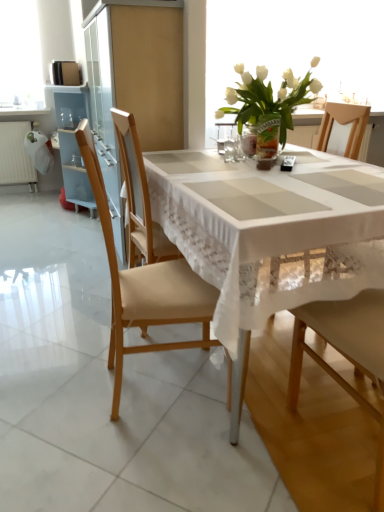
Question: Is white glass vase at upper center behind light brown wood chair at left, the first chair when ordered from left to right?

Choices:
 (A) no
 (B) yes

Answer: (B)

Question: Is white glass vase at upper center not close to light brown wood chair at left, the first chair when ordered from left to right?

Choices:
 (A) no
 (B) yes

Answer: (B)

Question: Does white glass vase at upper center come in front of light brown wood chair at left, acting as the 2th chair starting from the right?

Choices:
 (A) no
 (B) yes

Answer: (A)

Question: From the image's perspective, would you say white glass vase at upper center is shown under light brown wood chair at left, acting as the 2th chair starting from the right?

Choices:
 (A) yes
 (B) no

Answer: (B)

Question: From the image's perspective, is white glass vase at upper center located above light brown wood chair at left, acting as the 2th chair starting from the right?

Choices:
 (A) yes
 (B) no

Answer: (A)

Question: Choose the correct answer: Is white glass vase at upper center inside white lace tablecloth at center or outside it?

Choices:
 (A) outside
 (B) inside

Answer: (A)

Question: From a real-world perspective, is white glass vase at upper center physically located above or below white lace tablecloth at center?

Choices:
 (A) above
 (B) below

Answer: (A)

Question: Is white glass vase at upper center in front of or behind white lace tablecloth at center in the image?

Choices:
 (A) behind
 (B) front

Answer: (A)

Question: In terms of size, does white glass vase at upper center appear bigger or smaller than white lace tablecloth at center?

Choices:
 (A) small
 (B) big

Answer: (A)

Question: From the image's perspective, is translucent glass vase at center above or below white lace tablecloth at center?

Choices:
 (A) below
 (B) above

Answer: (B)

Question: Considering the positions of translucent glass vase at center and white lace tablecloth at center in the image, is translucent glass vase at center taller or shorter than white lace tablecloth at center?

Choices:
 (A) tall
 (B) short

Answer: (B)

Question: Considering the positions of point (261, 131) and point (215, 216), is point (261, 131) closer or farther from the camera than point (215, 216)?

Choices:
 (A) farther
 (B) closer

Answer: (A)

Question: Is translucent glass vase at center wider or thinner than white lace tablecloth at center?

Choices:
 (A) wide
 (B) thin

Answer: (B)

Question: Is light brown wood chair at left, acting as the 2th chair starting from the right, to the left or to the right of translucent glass vase at center in the image?

Choices:
 (A) right
 (B) left

Answer: (B)

Question: Considering their positions, is light brown wood chair at left, acting as the 2th chair starting from the right, located in front of or behind translucent glass vase at center?

Choices:
 (A) front
 (B) behind

Answer: (A)